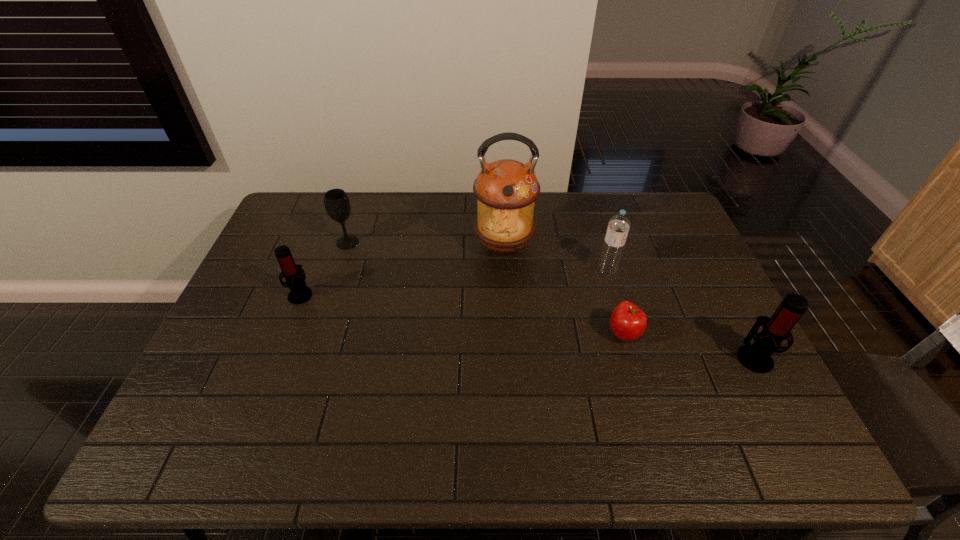
If the aim is uniform spacing by inserting an additional microphone among them, please point to a vacant space for this new microphone. Please provide its 2D coordinates. Your answer should be formatted as a tuple, i.e. [(x, y)], where the tuple contains the x and y coordinates of a point satisfying the conditions above.

[(513, 323)]